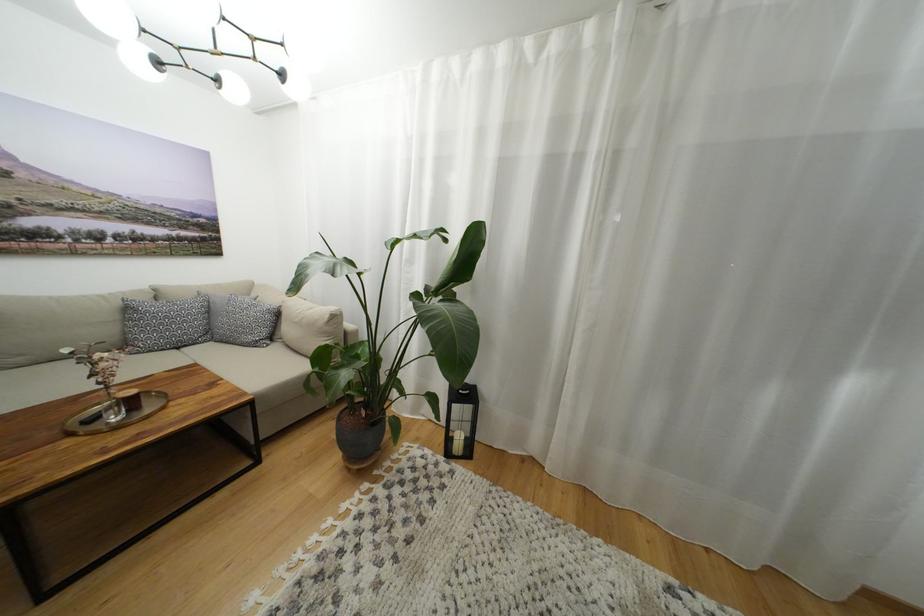
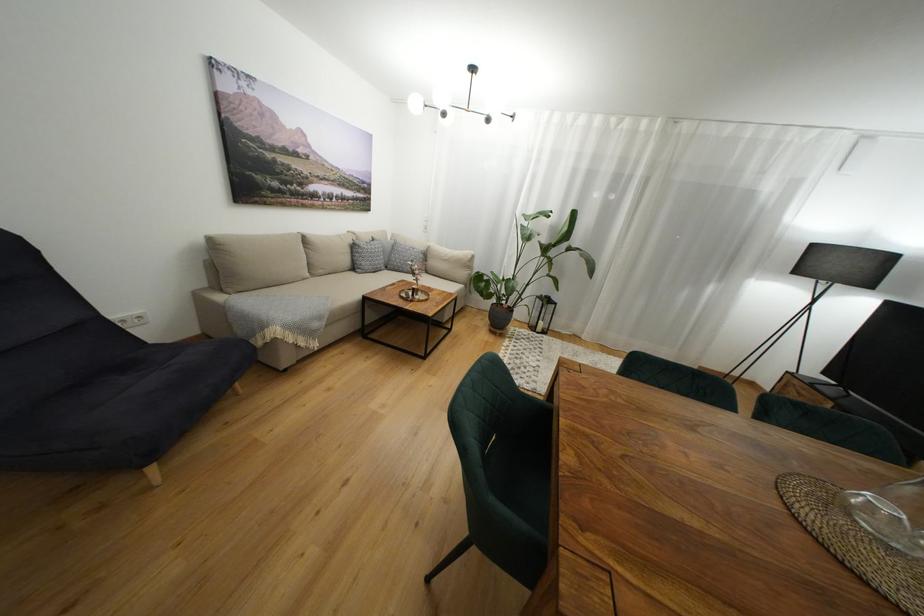
Which direction would the cameraman need to move to produce the second image?

The cameraman walked toward left, backward.